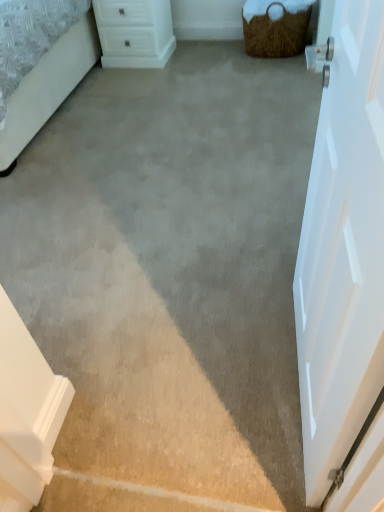
Find the location of a particular element. vacant space underneath white smooth door at right (from a real-world perspective) is located at coordinates (284, 355).